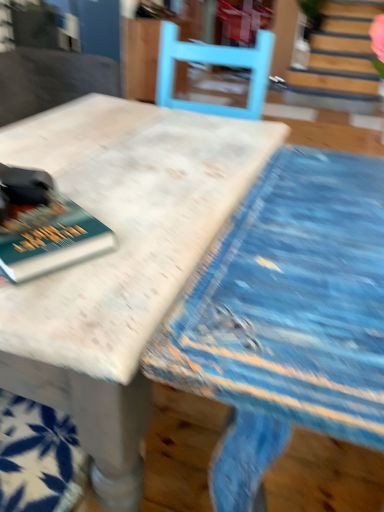
Question: From the image's perspective, is hardcover book at left positioned above or below white marble table at center?

Choices:
 (A) above
 (B) below

Answer: (A)

Question: Relative to white marble table at center, is hardcover book at left in front or behind?

Choices:
 (A) front
 (B) behind

Answer: (B)

Question: In terms of width, does hardcover book at left look wider or thinner when compared to white marble table at center?

Choices:
 (A) thin
 (B) wide

Answer: (A)

Question: Based on their positions, is white marble table at center located to the left or right of hardcover book at left?

Choices:
 (A) right
 (B) left

Answer: (A)

Question: In terms of height, does white marble table at center look taller or shorter compared to hardcover book at left?

Choices:
 (A) tall
 (B) short

Answer: (A)

Question: In terms of size, does white marble table at center appear bigger or smaller than hardcover book at left?

Choices:
 (A) small
 (B) big

Answer: (B)

Question: From the image's perspective, is white marble table at center positioned above or below hardcover book at left?

Choices:
 (A) above
 (B) below

Answer: (B)